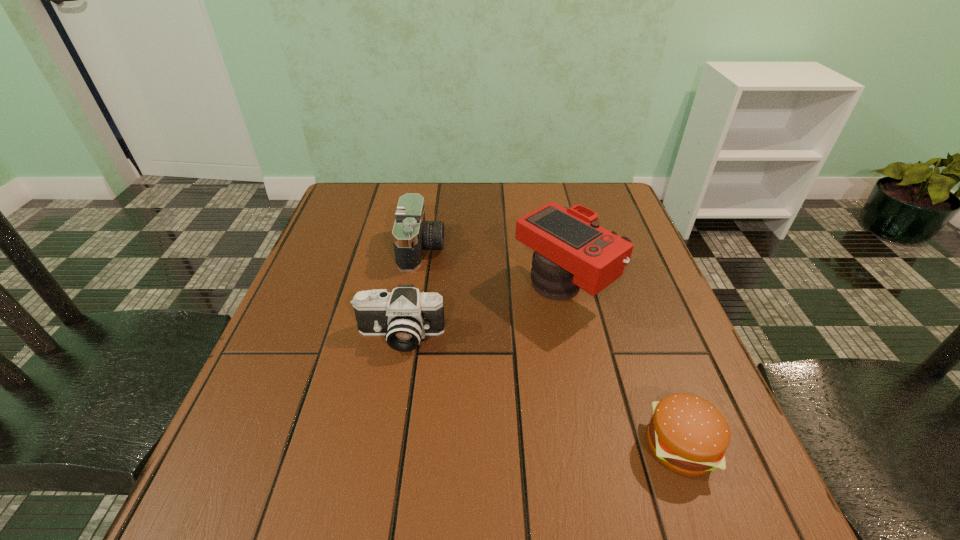
Identify the location of object that is the closest to the tallest object. Image resolution: width=960 pixels, height=540 pixels. (405, 316).

What are the coordinates of `object identified as the third closest to the tallest camera` in the screenshot? It's located at (688, 435).

Find the location of a particular element. The height and width of the screenshot is (540, 960). the second closest camera to the tallest camera is located at coordinates (411, 234).

Identify which camera is located as the second nearest to the tallest object. Please provide its 2D coordinates. Your answer should be formatted as a tuple, i.e. [(x, y)], where the tuple contains the x and y coordinates of a point satisfying the conditions above.

[(411, 234)]